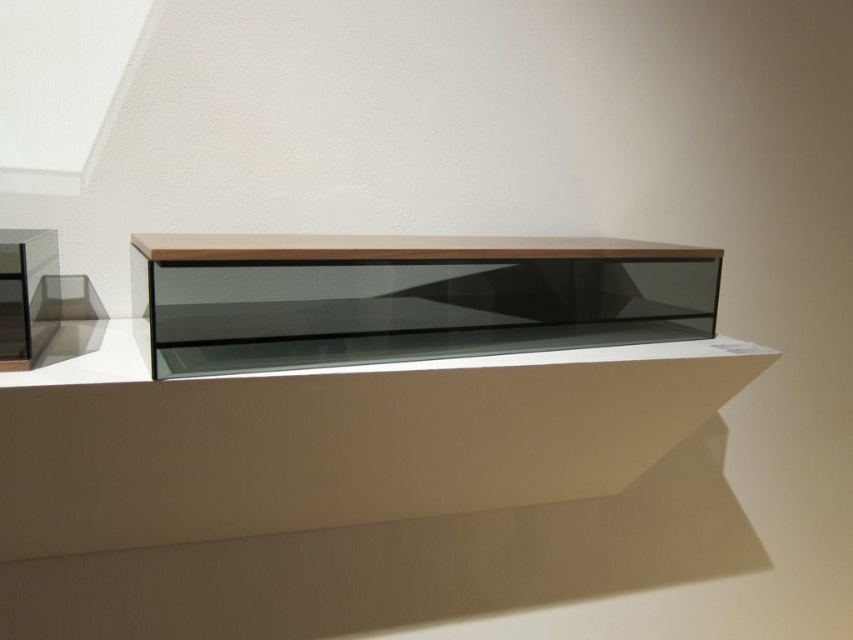
Question: Does white matte ledge at center appear on the left side of matte wood shelf at center?

Choices:
 (A) yes
 (B) no

Answer: (A)

Question: Considering the real-world distances, which object is closest to the white matte ledge at center?

Choices:
 (A) transparent glass shelf at left
 (B) matte wood shelf at center

Answer: (B)

Question: Which point is farther to the camera?

Choices:
 (A) (538, 284)
 (B) (207, 531)

Answer: (A)

Question: Can you confirm if white matte ledge at center is positioned below matte wood shelf at center?

Choices:
 (A) no
 (B) yes

Answer: (B)

Question: Which point is farther to the camera?

Choices:
 (A) (10, 356)
 (B) (83, 412)

Answer: (B)

Question: Is matte wood shelf at center smaller than transparent glass shelf at left?

Choices:
 (A) yes
 (B) no

Answer: (B)